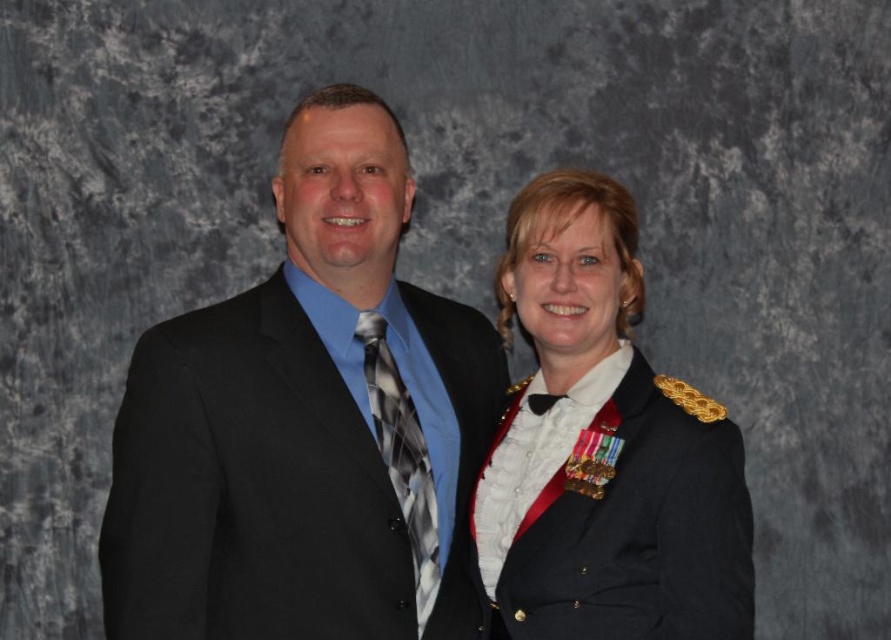
You are a photographer setting up for a group photo. You need to ensure that both the black suit at left and the shiny black uniform at center are in focus. Which object should you adjust your camera focus on first to ensure proper depth of field?

The black suit at left is closer to the viewer than the shiny black uniform at center. To ensure both are in focus, you should focus on the shiny black uniform at center first, as it is farther away, allowing the depth of field to cover both objects.

You are organizing a formal event and need to ensure that all attire items are displayed properly. You have a black suit at left and a plaid silk tie at center. Which item requires a larger display space?

The black suit at left requires a larger display space because it is bigger than the plaid silk tie at center.

You are a photographer setting up for a group photo. The black suit at left and the plaid silk tie at center are in your frame. Based on their positions, which object would you adjust to ensure both are centered equally in the photo?

The black suit at left might be wider than the plaid silk tie at center, so you should move the black suit at left slightly to the right to balance their widths in the frame.